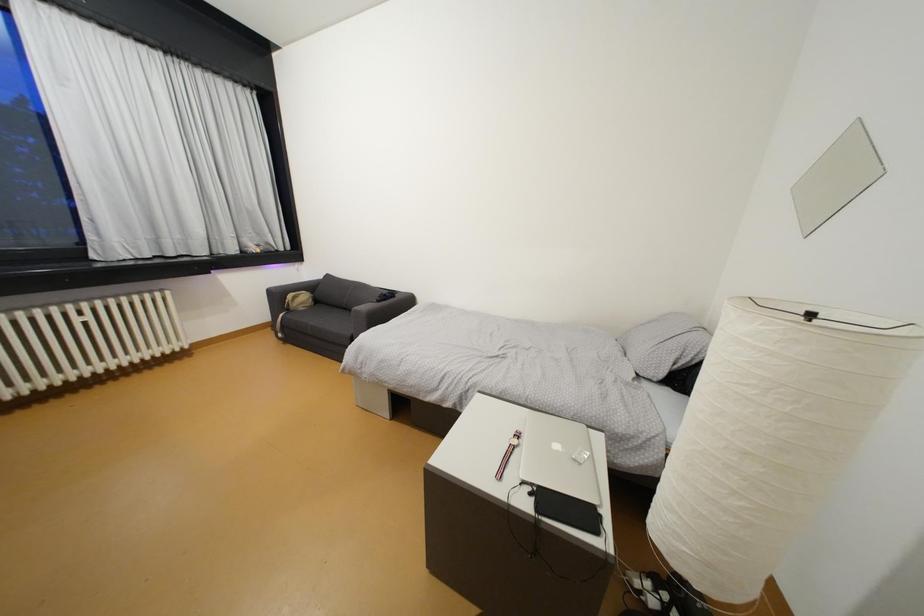
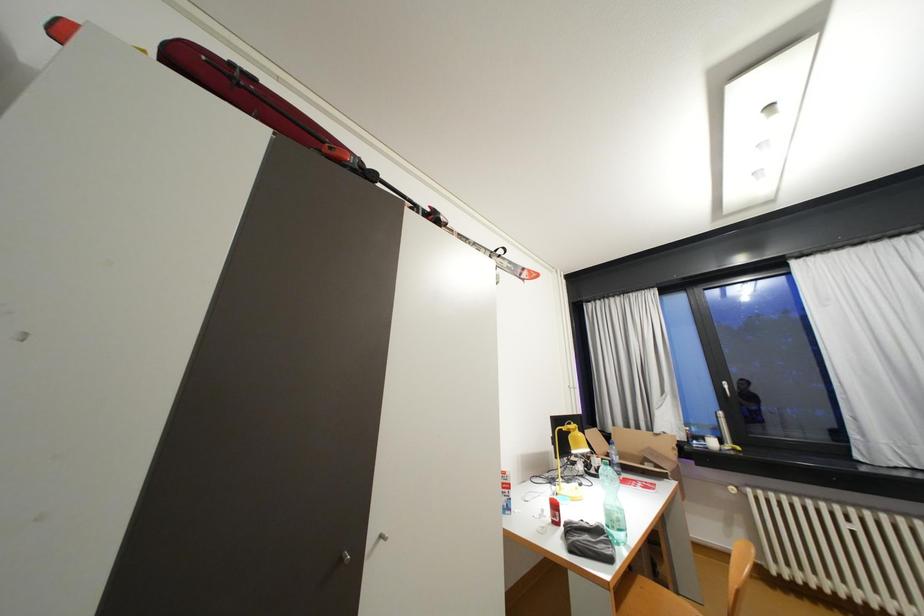
Question: The first image is from the beginning of the video and the second image is from the end. How did the camera likely rotate when shooting the video?

Choices:
 (A) Left
 (B) Right
 (C) Up
 (D) Down

Answer: (A)